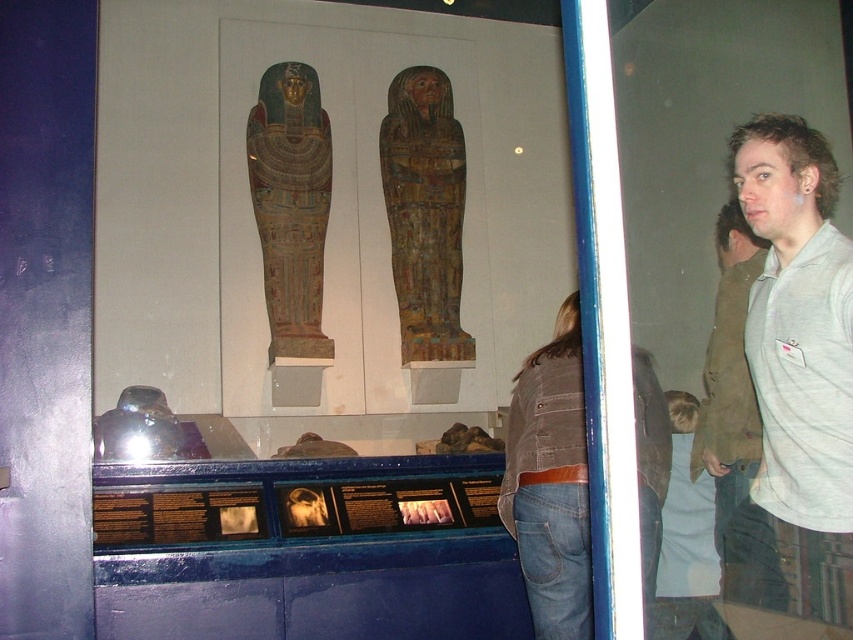
You are a tour guide in the museum and want to point out the two gray cotton garments displayed at the right side of the exhibit. Which one is taller between the gray cotton shirt at right and the gray cotton sweatshirt at right?

The gray cotton shirt at right is taller than the gray cotton sweatshirt at right according to the description provided.

You are standing in the museum and want to take a photo of the wooden painted sarcophagus at center. Where should you position yourself to capture it in the frame?

You should position yourself facing the wooden painted sarcophagus at center located at coordinates point (425, 212) to ensure it is centered in your photo.

You are a security guard at the museum and need to ensure visitors are maintaining a safe distance from the display case. You notice two visitors wearing the brown denim jacket at lower right and the gray cotton sweatshirt at right. Which visitor is standing closer to the display case?

The brown denim jacket at lower right is larger in width than the gray cotton sweatshirt at right, but the question about their distance from the display case cannot be determined from the given information.